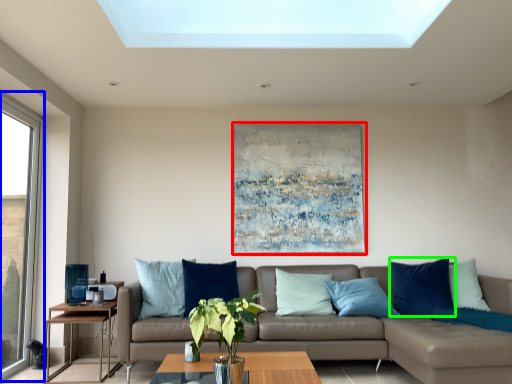
Question: Which is farther away from picture frame (highlighted by a red box)? window (highlighted by a blue box) or pillow (highlighted by a green box)?

Choices:
 (A) window
 (B) pillow

Answer: (A)